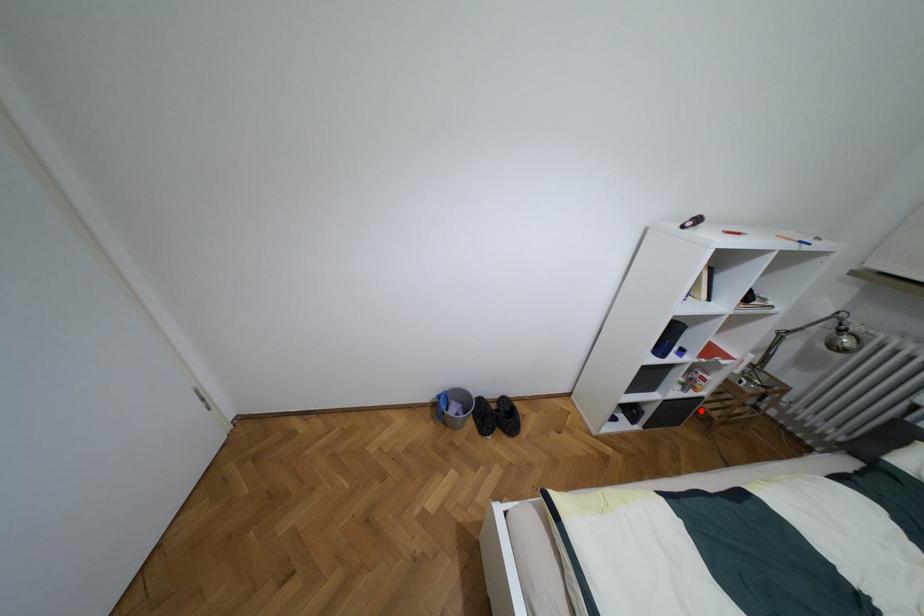
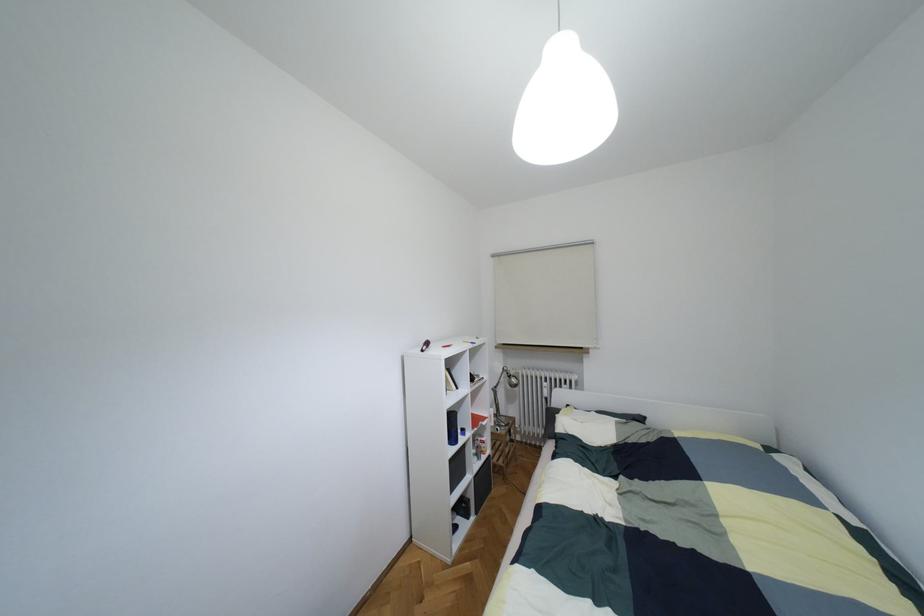
The point at the highlighted location is marked in the first image. Where is the corresponding point in the second image?

(493, 464)